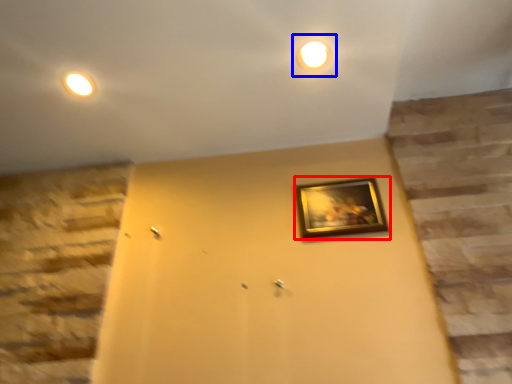
Question: Which of the following is the closest to the observer, picture frame (highlighted by a red box) or light (highlighted by a blue box)?

Choices:
 (A) picture frame
 (B) light

Answer: (B)